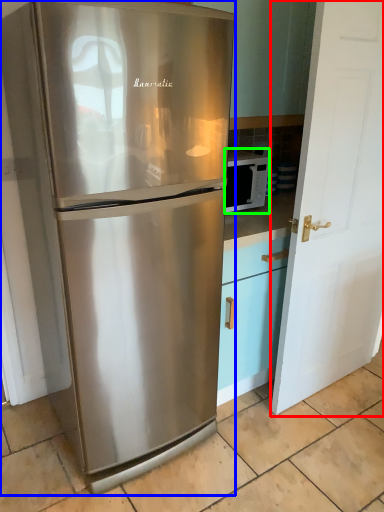
Question: Based on their relative distances, which object is nearer to door (highlighted by a red box)? Choose from refrigerator (highlighted by a blue box) and microwave oven (highlighted by a green box).

Choices:
 (A) refrigerator
 (B) microwave oven

Answer: (B)